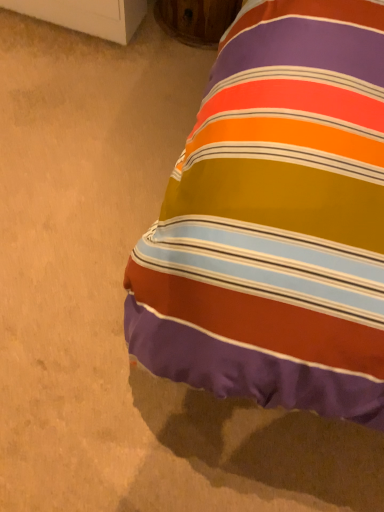
The width and height of the screenshot is (384, 512). What do you see at coordinates (276, 220) in the screenshot?
I see `matte striped pillow at lower right` at bounding box center [276, 220].

Locate an element on the screen. The image size is (384, 512). matte striped pillow at lower right is located at coordinates (276, 220).

This screenshot has height=512, width=384. Find the location of `matte striped pillow at lower right`. matte striped pillow at lower right is located at coordinates (276, 220).